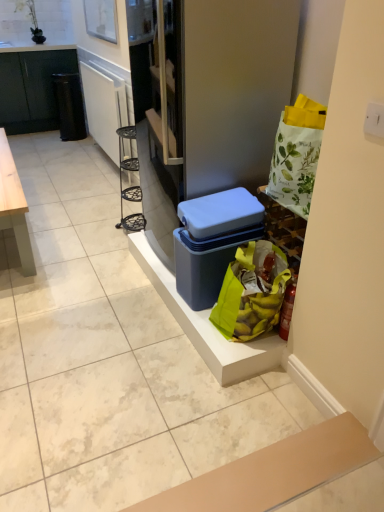
Question: Does banana-patterned fabric bag at lower right have a greater width compared to black matte cabinet at left?

Choices:
 (A) yes
 (B) no

Answer: (B)

Question: Is banana-patterned fabric bag at lower right further to camera compared to black matte cabinet at left?

Choices:
 (A) yes
 (B) no

Answer: (B)

Question: Is banana-patterned fabric bag at lower right looking in the opposite direction of black matte cabinet at left?

Choices:
 (A) no
 (B) yes

Answer: (A)

Question: Considering the relative sizes of banana-patterned fabric bag at lower right and black matte cabinet at left in the image provided, is banana-patterned fabric bag at lower right bigger than black matte cabinet at left?

Choices:
 (A) yes
 (B) no

Answer: (B)

Question: Can you confirm if banana-patterned fabric bag at lower right is smaller than black matte cabinet at left?

Choices:
 (A) no
 (B) yes

Answer: (B)

Question: Based on their positions, is black matte cabinet at left located to the left or right of matte white fridge at center?

Choices:
 (A) right
 (B) left

Answer: (B)

Question: From the image's perspective, relative to matte white fridge at center, is black matte cabinet at left above or below?

Choices:
 (A) above
 (B) below

Answer: (A)

Question: Considering the positions of point (66, 58) and point (266, 86), is point (66, 58) closer or farther from the camera than point (266, 86)?

Choices:
 (A) farther
 (B) closer

Answer: (A)

Question: Relative to matte white fridge at center, is black matte cabinet at left in front or behind?

Choices:
 (A) behind
 (B) front

Answer: (A)

Question: Considering the positions of matte white fridge at center and banana-patterned fabric bag at lower right in the image, is matte white fridge at center wider or thinner than banana-patterned fabric bag at lower right?

Choices:
 (A) thin
 (B) wide

Answer: (B)

Question: Is point (276, 40) positioned closer to the camera than point (284, 266)?

Choices:
 (A) closer
 (B) farther

Answer: (A)

Question: Do you think matte white fridge at center is within banana-patterned fabric bag at lower right, or outside of it?

Choices:
 (A) outside
 (B) inside

Answer: (A)

Question: From a real-world perspective, is matte white fridge at center above or below banana-patterned fabric bag at lower right?

Choices:
 (A) below
 (B) above

Answer: (B)

Question: From a real-world perspective, is black plastic trash can at left positioned above or below blue plastic storage box at center?

Choices:
 (A) below
 (B) above

Answer: (A)

Question: Looking at the image, does black plastic trash can at left seem bigger or smaller compared to blue plastic storage box at center?

Choices:
 (A) big
 (B) small

Answer: (A)